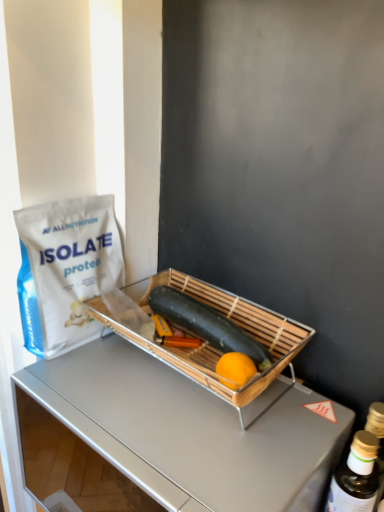
This screenshot has width=384, height=512. Find the location of `free space that is to the left of smooth green zucchini at center`. free space that is to the left of smooth green zucchini at center is located at coordinates (100, 369).